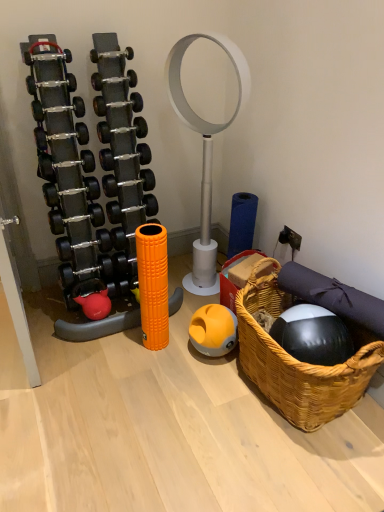
Where is `vacant space to the left of woven brown basket at lower right`? vacant space to the left of woven brown basket at lower right is located at coordinates (190, 402).